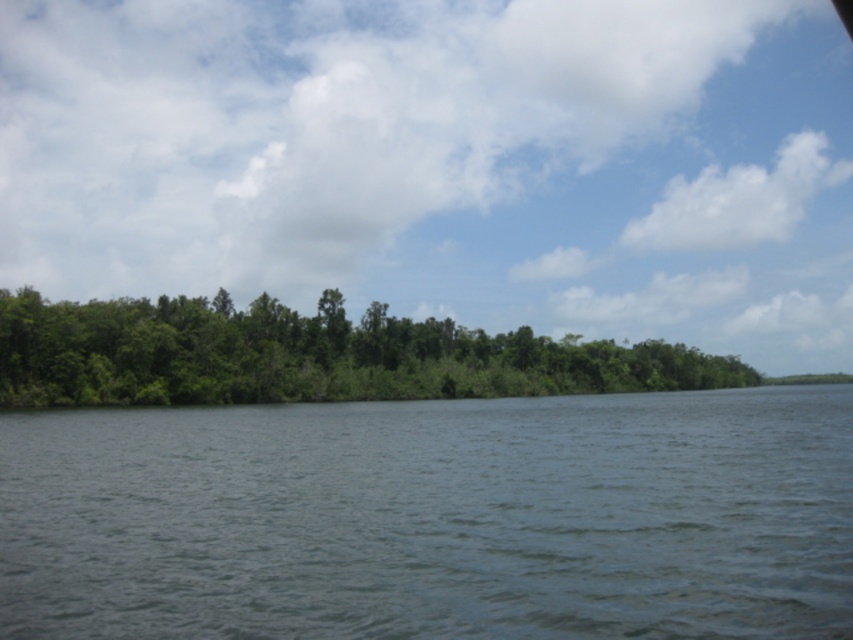
You are standing on a path near the dark blue water at center and the green leafy trees at center. Which object is closer to you?

The dark blue water at center is closer to you because it is positioned under the green leafy trees at center, meaning the trees are further away.

You are standing at the edge of the scene and want to reach the green leafy trees at center. Which direction should you move to get closer to them, considering the dark blue water at center is in your way?

The dark blue water at center is closer to the viewer than the green leafy trees at center, so you should move around the dark blue water at center to reach the green leafy trees at center.

You are standing at the edge of the water in the image. There is a point marked at coordinates (434,518) which indicates dark blue water at center. Can you confirm if this point is located in the water?

Yes, the point marked at coordinates (434,518) is located in the dark blue water at center as described.